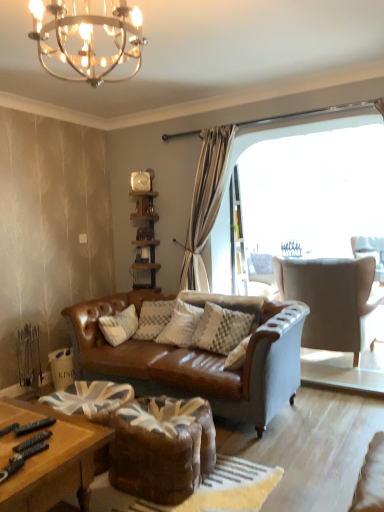
Question: From the image's perspective, is suede-like beige armchair at right above or below woodenshelf at center?

Choices:
 (A) below
 (B) above

Answer: (A)

Question: Looking at their shapes, would you say suede-like beige armchair at right is wider or thinner than woodenshelf at center?

Choices:
 (A) wide
 (B) thin

Answer: (A)

Question: Estimate the real-world distances between objects in this image. Which object is closer to the wooden polished coffee table at lower left?

Choices:
 (A) leather swivel chair at center
 (B) suede-like beige armchair at right
 (C) woodenshelf at center
 (D) clear glass screen door at center
 (E) metallic chandelier at upper center

Answer: (A)

Question: Which is nearer to the suede-like beige armchair at right?

Choices:
 (A) wooden polished coffee table at lower left
 (B) woodenshelf at center
 (C) metallic chandelier at upper center
 (D) clear glass screen door at center
 (E) leather swivel chair at center

Answer: (D)